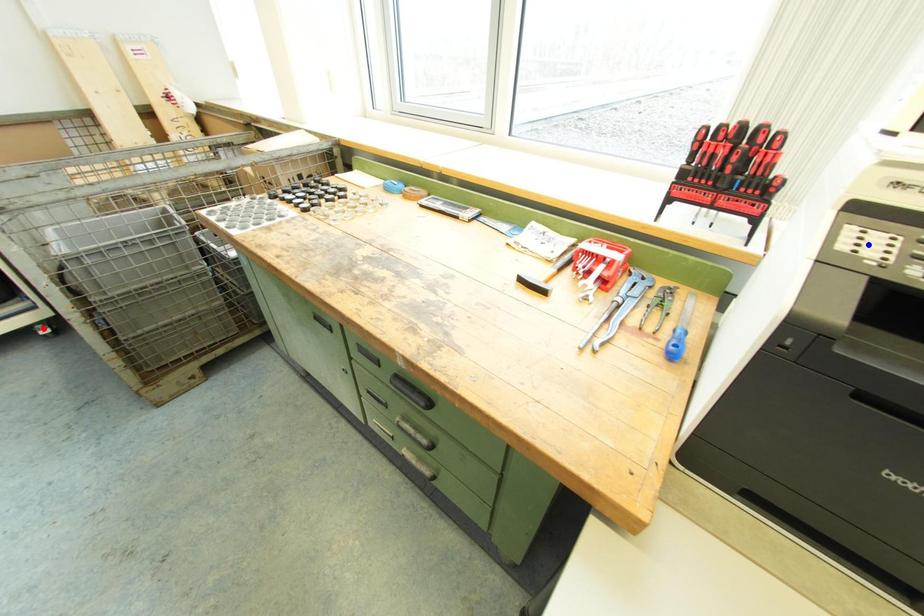
Question: Two points are marked on the image. Which point is closer to the camera?

Choices:
 (A) Blue point is closer.
 (B) Red point is closer.

Answer: (A)